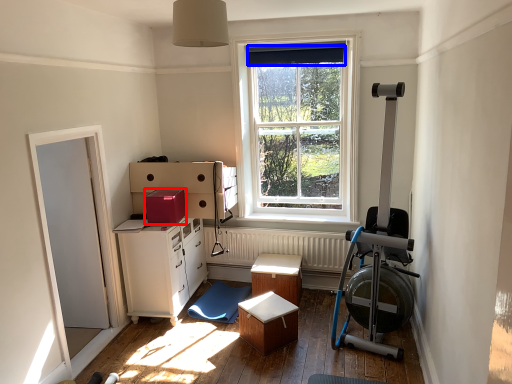
Question: Which object appears closest to the camera in this image, cardboard box (highlighted by a red box) or curtain (highlighted by a blue box)?

Choices:
 (A) cardboard box
 (B) curtain

Answer: (A)